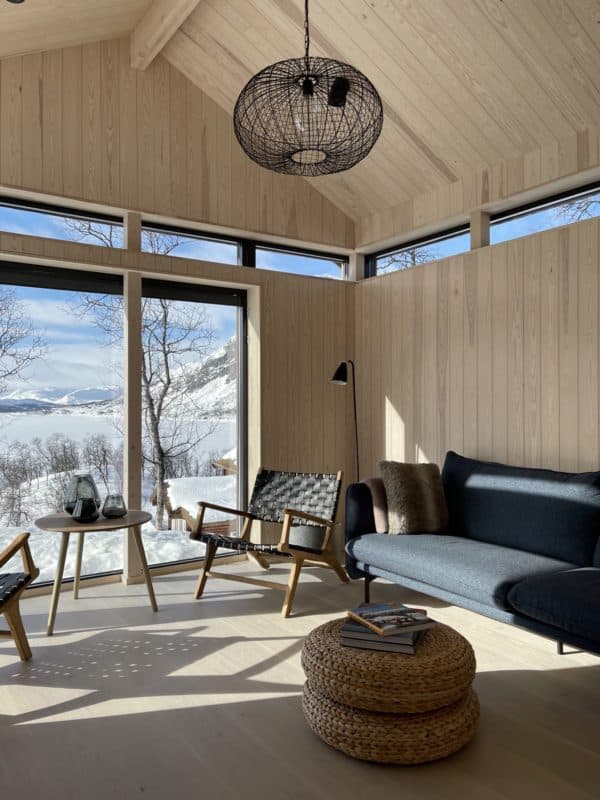
Where is `books`? This screenshot has width=600, height=800. books is located at coordinates (394, 630).